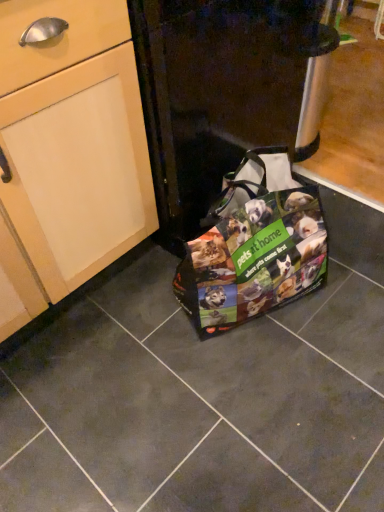
Where is `free location in front of black plastic trash can at lower center`? The height and width of the screenshot is (512, 384). free location in front of black plastic trash can at lower center is located at coordinates (169, 335).